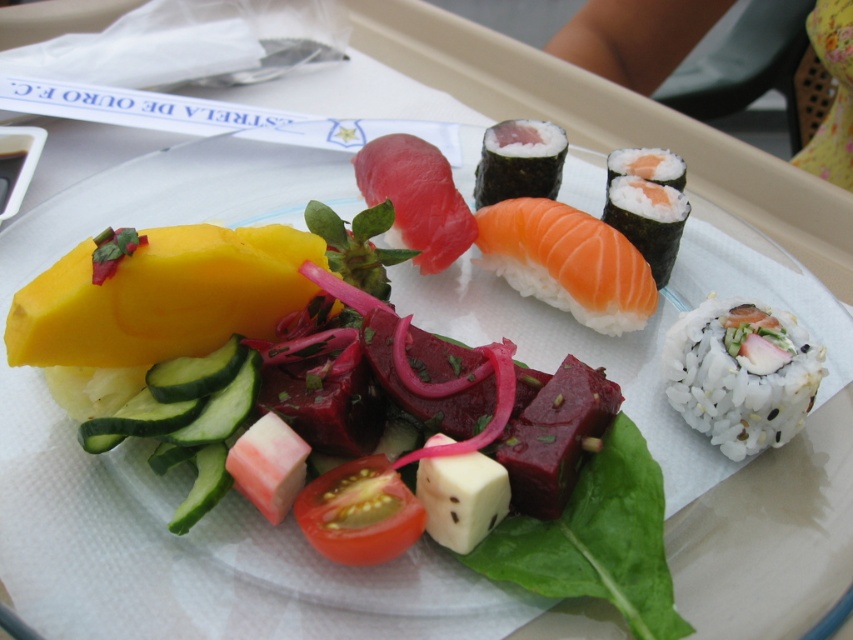
Question: Is white rice roll at right thinner than white soft cube at center?

Choices:
 (A) yes
 (B) no

Answer: (B)

Question: Does pink raw fish at center have a larger size compared to white rice with salmon at upper right?

Choices:
 (A) yes
 (B) no

Answer: (A)

Question: Considering the real-world distances, which object is closest to the salmon-colored fish at center?

Choices:
 (A) white rice roll at right
 (B) pink raw fish at center
 (C) white rice with salmon at upper right
 (D) slightly translucent red tomato at center

Answer: (C)

Question: Is slightly translucent red tomato at center wider than white rice wrapped in seaweed at upper right?

Choices:
 (A) no
 (B) yes

Answer: (A)

Question: Among these points, which one is nearest to the camera?

Choices:
 (A) (497, 189)
 (B) (637, 200)
 (C) (627, 163)
 (D) (366, 500)

Answer: (D)

Question: Which point is farther from the camera taking this photo?

Choices:
 (A) (521, 140)
 (B) (666, 225)
 (C) (361, 173)

Answer: (A)